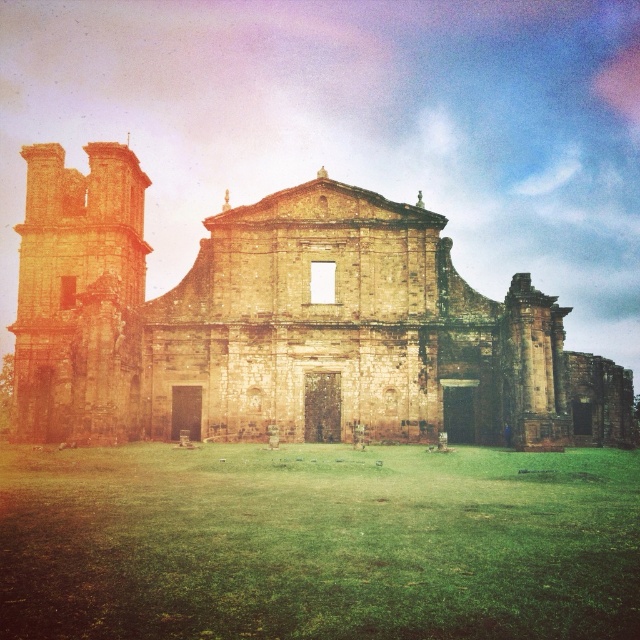
Question: Which of the following is the closest to the observer?

Choices:
 (A) brown stone church at center
 (B) green grass at center

Answer: (B)

Question: Which object is farther from the camera taking this photo?

Choices:
 (A) green grass at center
 (B) brown stone church at center

Answer: (B)

Question: Is brown stone church at center above green grass at center?

Choices:
 (A) yes
 (B) no

Answer: (A)

Question: Does brown stone church at center have a greater width compared to green grass at center?

Choices:
 (A) no
 (B) yes

Answer: (B)

Question: Is brown stone church at center smaller than green grass at center?

Choices:
 (A) no
 (B) yes

Answer: (A)